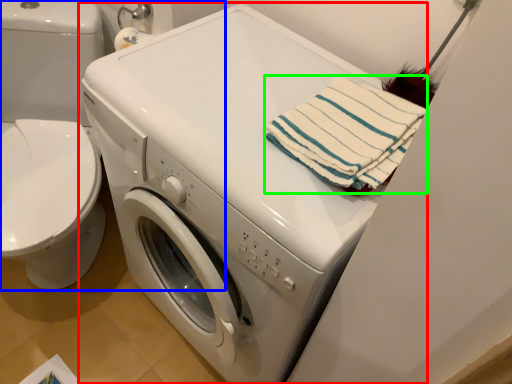
Question: Based on their relative distances, which object is nearer to washing machine (highlighted by a red box)? Choose from washer (highlighted by a blue box) and beach towel (highlighted by a green box).

Choices:
 (A) washer
 (B) beach towel

Answer: (B)